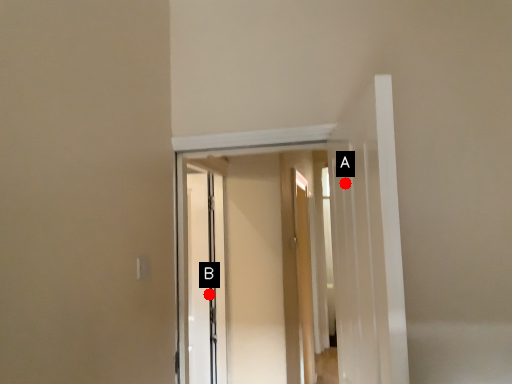
Question: Two points are circled on the image, labeled by A and B beside each circle. Which point is farther from the camera taking this photo?

Choices:
 (A) A is further
 (B) B is further

Answer: (B)